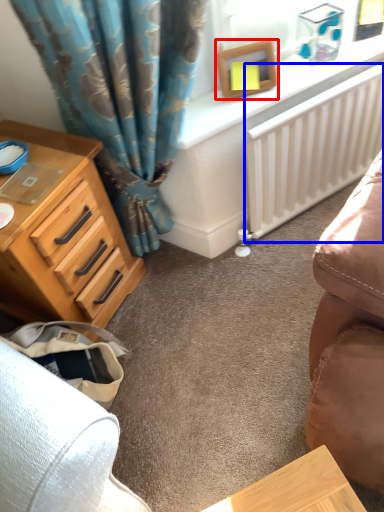
Question: Which point is further to the camera, picture frame (highlighted by a red box) or radiator (highlighted by a blue box)?

Choices:
 (A) picture frame
 (B) radiator

Answer: (B)